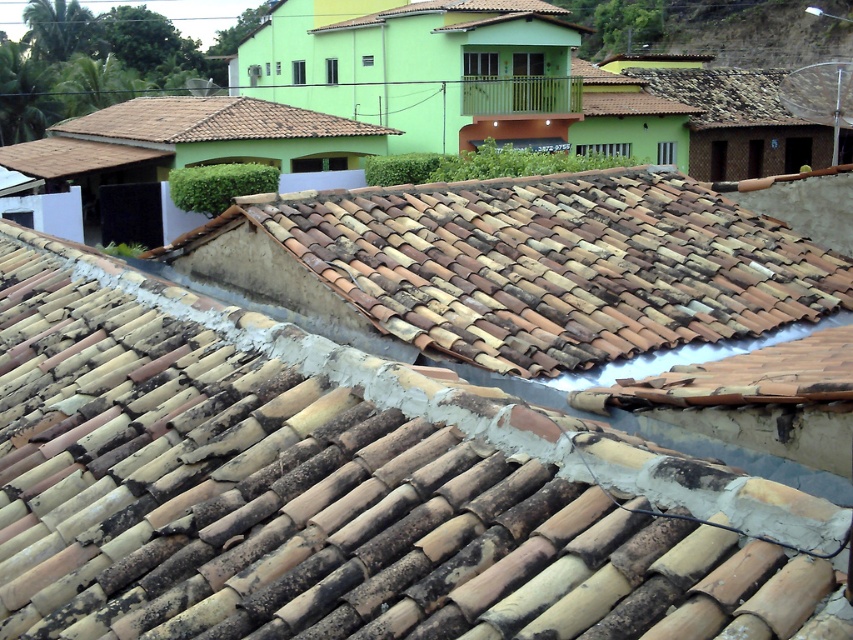
You are a construction worker assessing the roof tiles. You have two types of tiles in front of you, the brown weathered tiles at center and the brown clay tiles at center. Which type of tile is larger in size?

The brown weathered tiles at center are larger than the brown clay tiles at center.